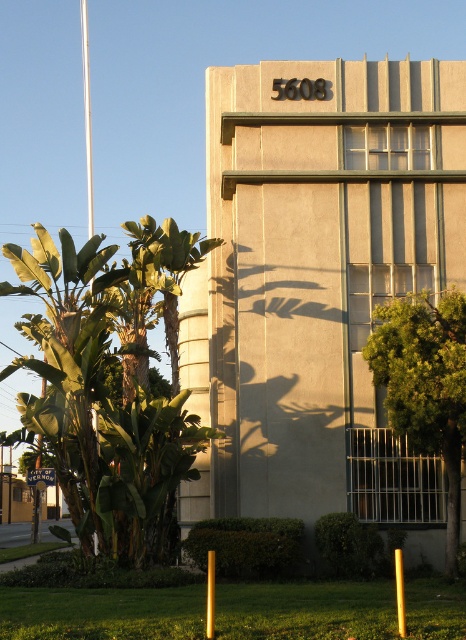
Who is positioned more to the left, metallic pole at center or yellow plastic pole at lower center?

Positioned to the left is metallic pole at center.

Can you confirm if metallic pole at center is shorter than yellow plastic pole at lower center?

Indeed, metallic pole at center has a lesser height compared to yellow plastic pole at lower center.

Describe the element at coordinates (210, 596) in the screenshot. Image resolution: width=466 pixels, height=640 pixels. I see `metallic pole at center` at that location.

You are a GUI agent. You are given a task and a screenshot of the screen. Output one action in this format:
    pyautogui.click(x=<x>, y=<y>)
    Task: Click on the metallic pole at center
    
    Given the screenshot: What is the action you would take?
    pyautogui.click(x=210, y=596)

Is green leafy tree at right positioned before metallic pole at center?

No, green leafy tree at right is behind metallic pole at center.

Can you confirm if green leafy tree at right is positioned above metallic pole at center?

Indeed, green leafy tree at right is positioned over metallic pole at center.

Is point (452, 477) less distant than point (211, 612)?

No, it is not.

You are a GUI agent. You are given a task and a screenshot of the screen. Output one action in this format:
    pyautogui.click(x=<x>, y=<y>)
    Task: Click on the green leafy tree at right
    The height and width of the screenshot is (640, 466).
    Given the screenshot: What is the action you would take?
    pyautogui.click(x=425, y=385)

Can you confirm if green leafy tree at left is taller than green leafy tree at right?

Yes.

Which is below, green leafy tree at left or green leafy tree at right?

green leafy tree at left is below.

Does point (102, 310) lie in front of point (443, 396)?

That is False.

Where is `green leafy tree at left`? green leafy tree at left is located at coordinates (97, 401).